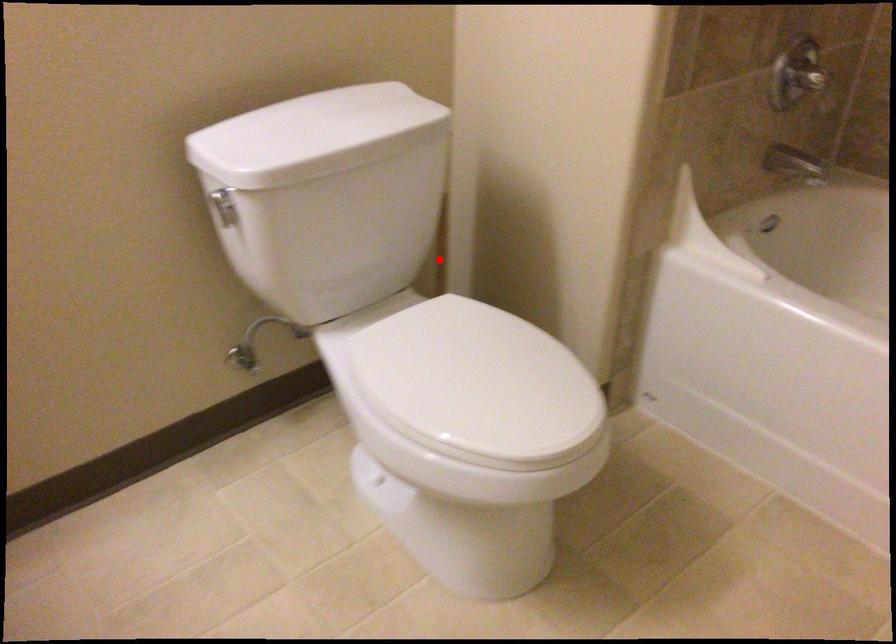
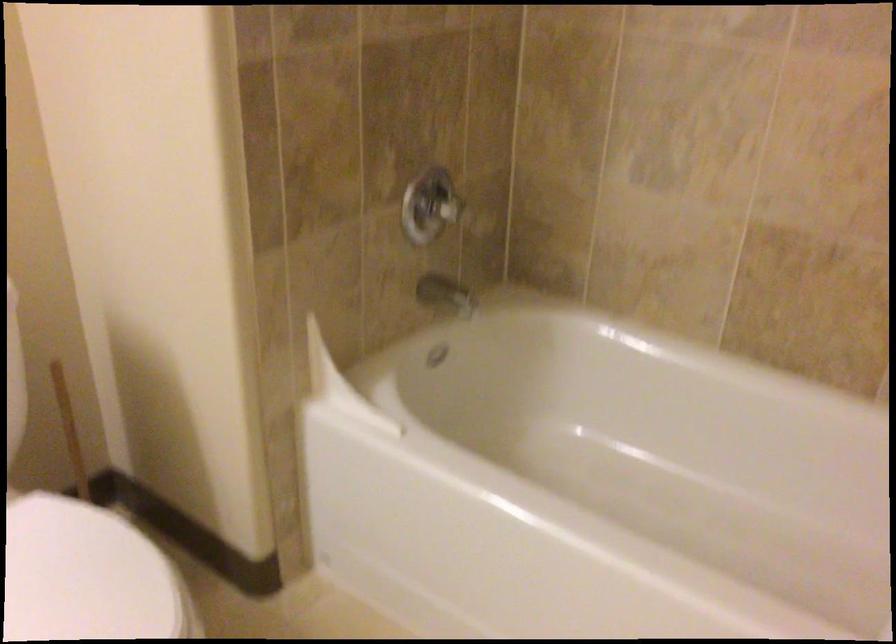
Locate, in the second image, the point that corresponds to the highlighted location in the first image.

(72, 438)